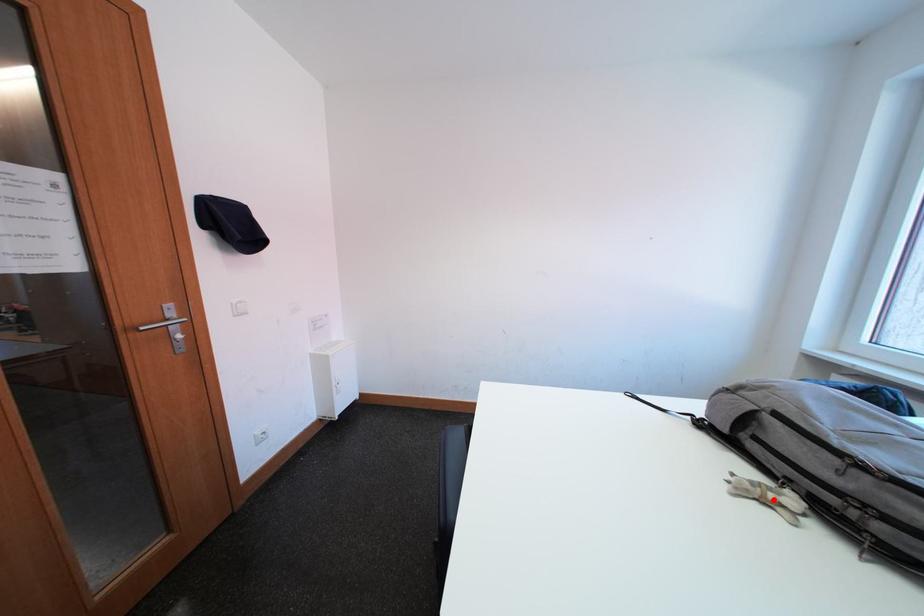
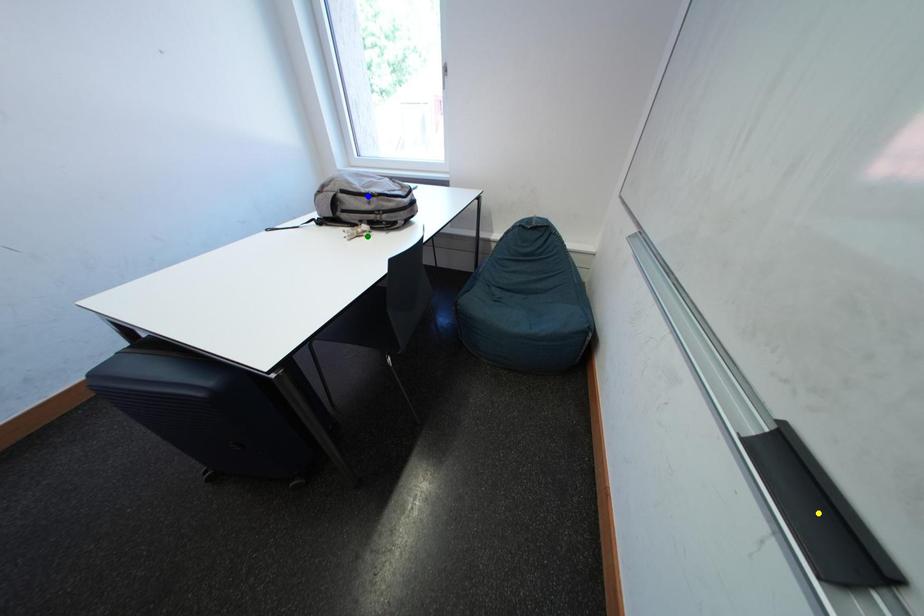
Question: I am providing you with two images of the same scene from different viewpoints. A red point is marked on the first image. You are given multiple points on the second image. In image 2, which mark is for the same physical point as the one in image 1?

Choices:
 (A) yellow point
 (B) green point
 (C) blue point

Answer: (B)